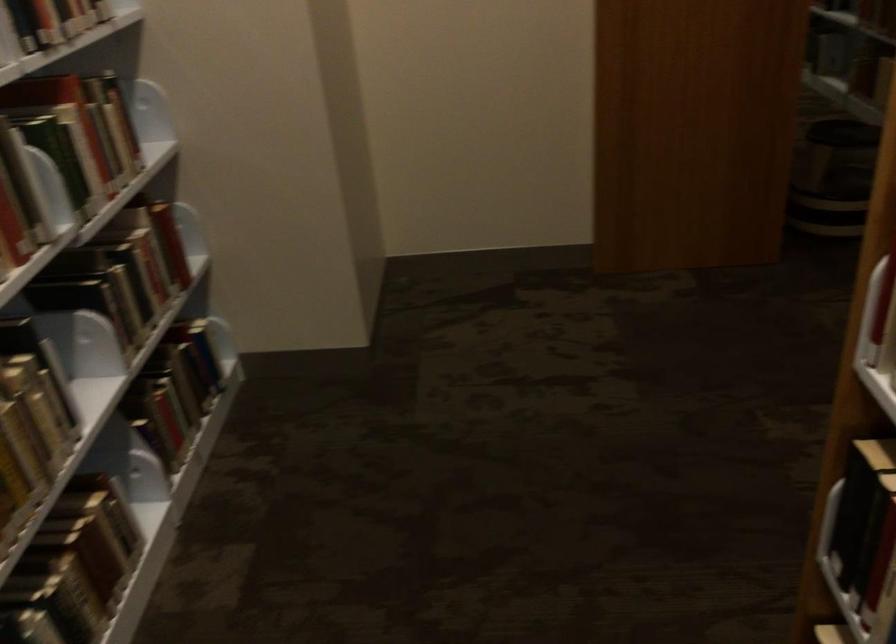
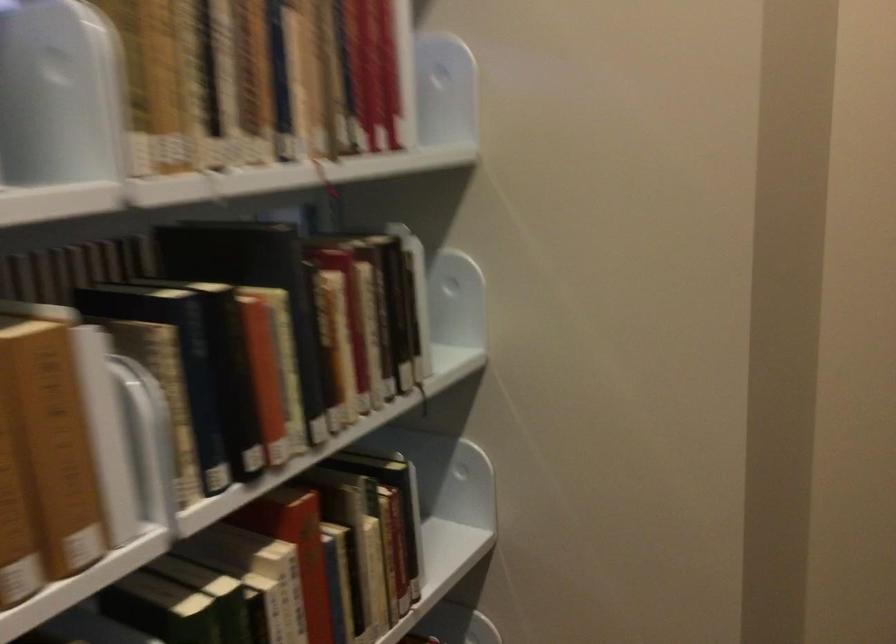
Find the pixel in the second image that matches point 71,115 in the first image.

(289, 564)